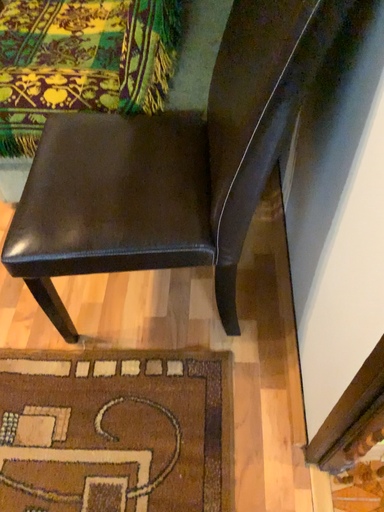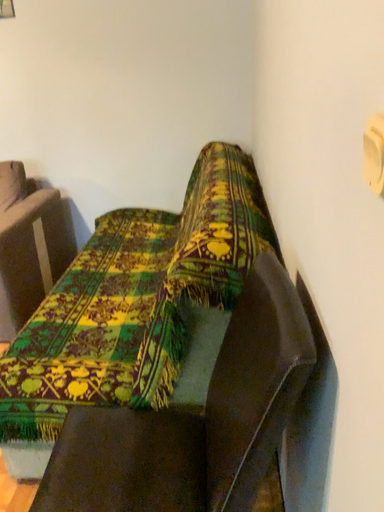
Question: Which way did the camera rotate in the video?

Choices:
 (A) rotated downward
 (B) rotated upward

Answer: (B)